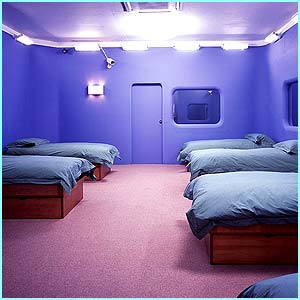
At what (x,y) coordinates should I click in order to perform the action: click on bed. Please return your answer as a coordinate pair (x, y). The height and width of the screenshot is (300, 300). Looking at the image, I should click on (85, 149).